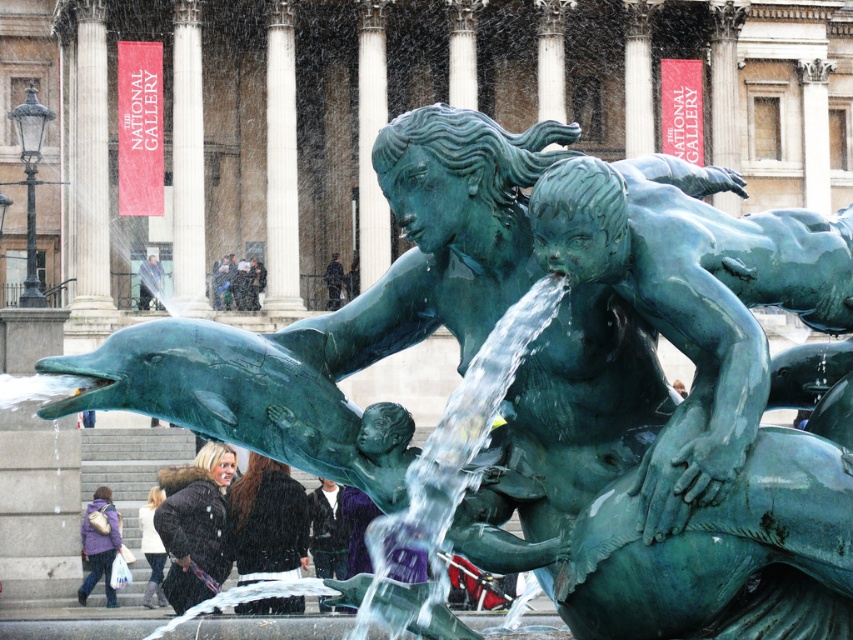
You are standing in front of the fountain at The National Gallery. You notice two points marked in the scene. The first point is at coordinates point (157, 586) and the second is at point (338, 291). Which of these two points is closer to you?

Point (157, 586) is closer to the viewer than point (338, 291).

You are standing in front of The National Gallery and want to take a photo of the green patina statue at center. The statue is 30.01 meters away from you. Your camera has a maximum focus range of 30 meters. Will your camera be able to focus on the statue?

The green patina statue at center is 30.01 meters away from the camera. Since the camera can only focus up to 30 meters, it will not be able to focus on the statue as it is slightly beyond the maximum range.

You are a fashion designer attending an event at The National Gallery. You see a dark brown leather coat at lower left and a dark brown leather jacket at center. Which one would you recommend to a client who prefers larger, more dramatic pieces?

The dark brown leather coat at lower left is bigger than the dark brown leather jacket at center, so it would be the better recommendation for a client preferring larger, more dramatic pieces.